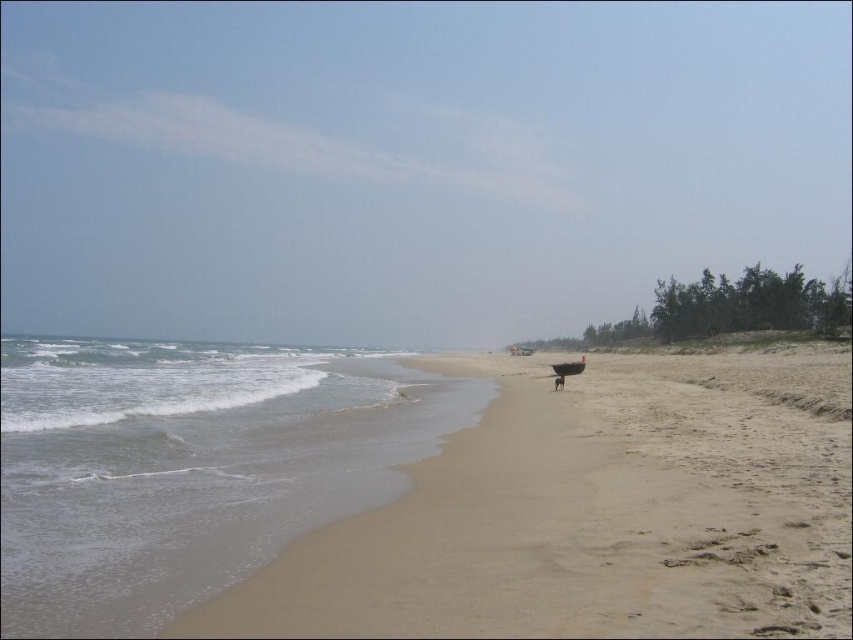
Question: Is light beige sand at lower left wider than gray sand at lower left?

Choices:
 (A) yes
 (B) no

Answer: (B)

Question: Which object appears closest to the camera in this image?

Choices:
 (A) gray sand at lower left
 (B) light beige sand at lower left

Answer: (B)

Question: Is light beige sand at lower left thinner than gray sand at lower left?

Choices:
 (A) no
 (B) yes

Answer: (B)

Question: Observing the image, what is the correct spatial positioning of light beige sand at lower left in reference to gray sand at lower left?

Choices:
 (A) left
 (B) right

Answer: (B)